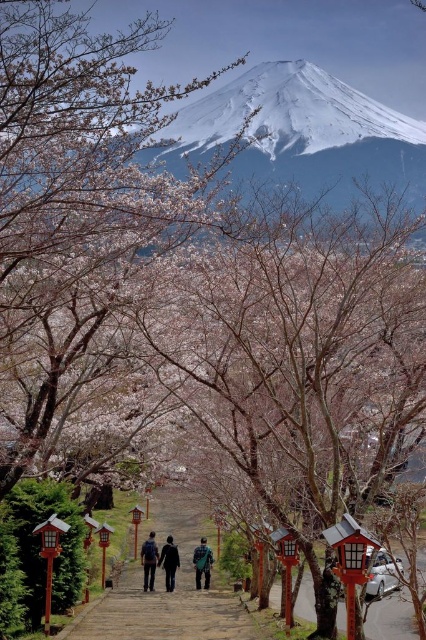
Question: Estimate the real-world distances between objects in this image. Which object is farther from the brown stone stairs at center?

Choices:
 (A) dark blue backpack at center
 (B) pink blossom tree at center
 (C) cherry blossom branches at center

Answer: (C)

Question: Among these points, which one is farthest from the camera?

Choices:
 (A) (207, 557)
 (B) (170, 560)
 (C) (86, 342)

Answer: (A)

Question: Is pink blossom tree at center to the right of green fabric jacket at center from the viewer's perspective?

Choices:
 (A) no
 (B) yes

Answer: (B)

Question: Is pink blossom tree at center thinner than dark blue backpack at center?

Choices:
 (A) no
 (B) yes

Answer: (A)

Question: Is pink blossom tree at center below green fabric jacket at center?

Choices:
 (A) yes
 (B) no

Answer: (B)

Question: Which object appears farthest from the camera in this image?

Choices:
 (A) cherry blossom branches at center
 (B) brown stone stairs at center
 (C) pink blossom tree at center

Answer: (B)